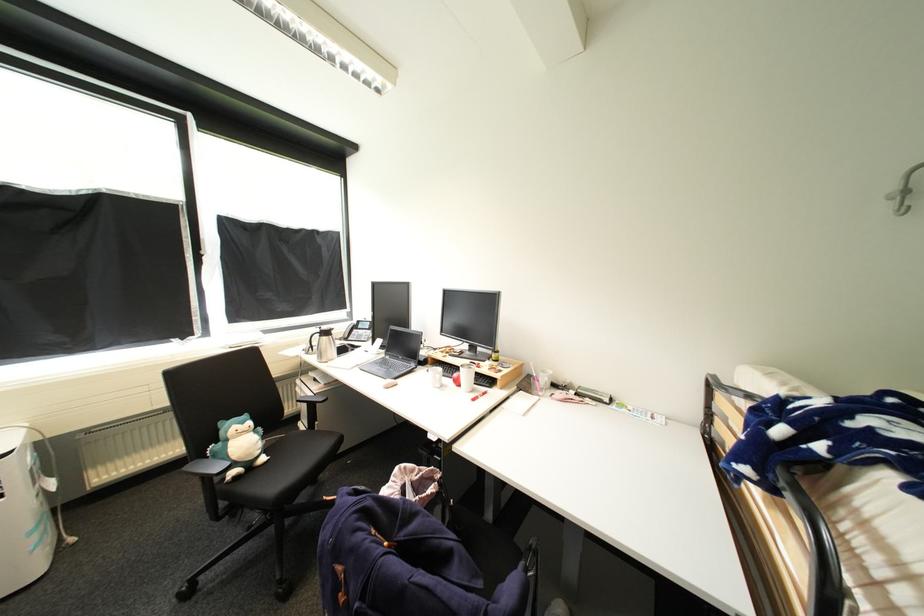
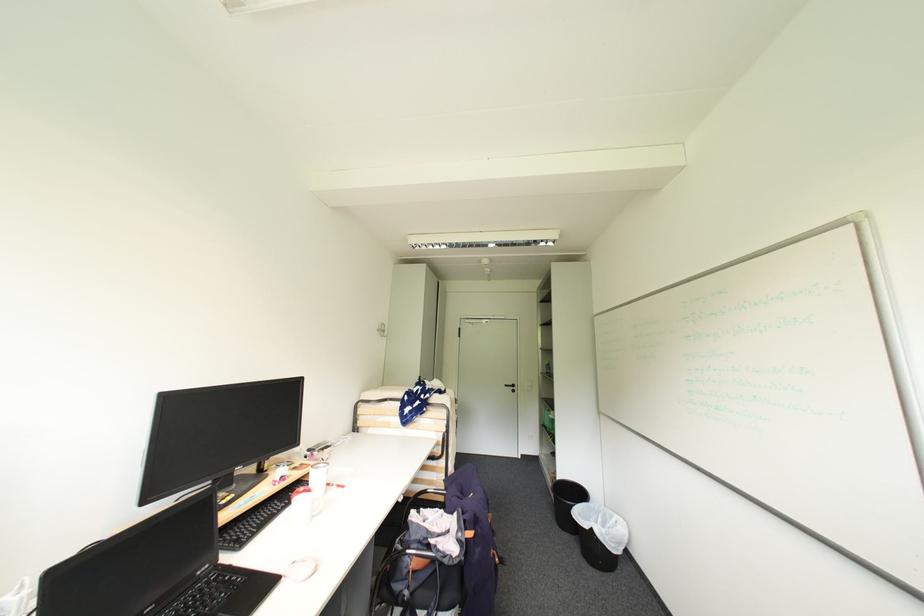
Where in the second image is the point corresponding to (x=435, y=437) from the first image?

(407, 501)